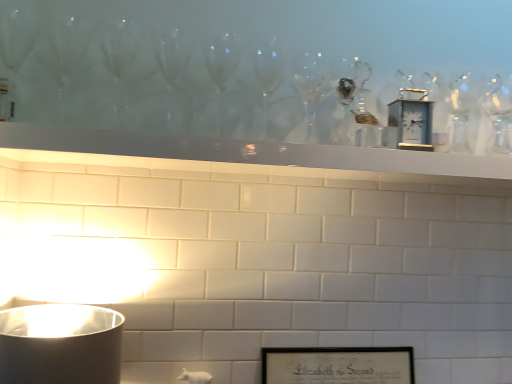
Question: Is white glossy mantle at upper center at the back of black matte picture frame at lower center?

Choices:
 (A) yes
 (B) no

Answer: (B)

Question: Is black matte picture frame at lower center beside white glossy mantle at upper center?

Choices:
 (A) yes
 (B) no

Answer: (B)

Question: Does black matte picture frame at lower center appear on the right side of white glossy mantle at upper center?

Choices:
 (A) yes
 (B) no

Answer: (A)

Question: Does black matte picture frame at lower center have a greater height compared to white glossy mantle at upper center?

Choices:
 (A) yes
 (B) no

Answer: (A)

Question: Is black matte picture frame at lower center at the left side of white glossy mantle at upper center?

Choices:
 (A) yes
 (B) no

Answer: (B)

Question: In terms of width, does metallic silver clock at upper center look wider or thinner when compared to black matte picture frame at lower center?

Choices:
 (A) wide
 (B) thin

Answer: (B)

Question: Choose the correct answer: Is metallic silver clock at upper center inside black matte picture frame at lower center or outside it?

Choices:
 (A) inside
 (B) outside

Answer: (B)

Question: Is metallic silver clock at upper center to the left or to the right of black matte picture frame at lower center in the image?

Choices:
 (A) left
 (B) right

Answer: (B)

Question: Is point (422, 92) closer or farther from the camera than point (329, 350)?

Choices:
 (A) closer
 (B) farther

Answer: (B)

Question: Based on their positions, is black matte picture frame at lower center located to the left or right of white glossy mantle at upper center?

Choices:
 (A) right
 (B) left

Answer: (A)

Question: Is black matte picture frame at lower center in front of or behind white glossy mantle at upper center in the image?

Choices:
 (A) behind
 (B) front

Answer: (A)

Question: Is point (391, 357) closer or farther from the camera than point (190, 137)?

Choices:
 (A) farther
 (B) closer

Answer: (A)

Question: From the image's perspective, is black matte picture frame at lower center above or below white glossy mantle at upper center?

Choices:
 (A) below
 (B) above

Answer: (A)

Question: From the image's perspective, is white glossy mantle at upper center above or below black matte picture frame at lower center?

Choices:
 (A) below
 (B) above

Answer: (B)

Question: From a real-world perspective, relative to black matte picture frame at lower center, is white glossy mantle at upper center vertically above or below?

Choices:
 (A) below
 (B) above

Answer: (B)